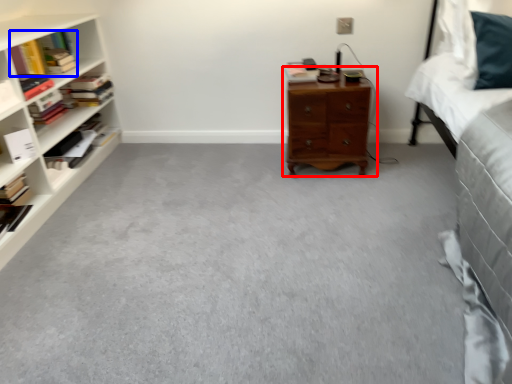
Question: Which of the following is the farthest to the observer, nightstand (highlighted by a red box) or book (highlighted by a blue box)?

Choices:
 (A) nightstand
 (B) book

Answer: (B)